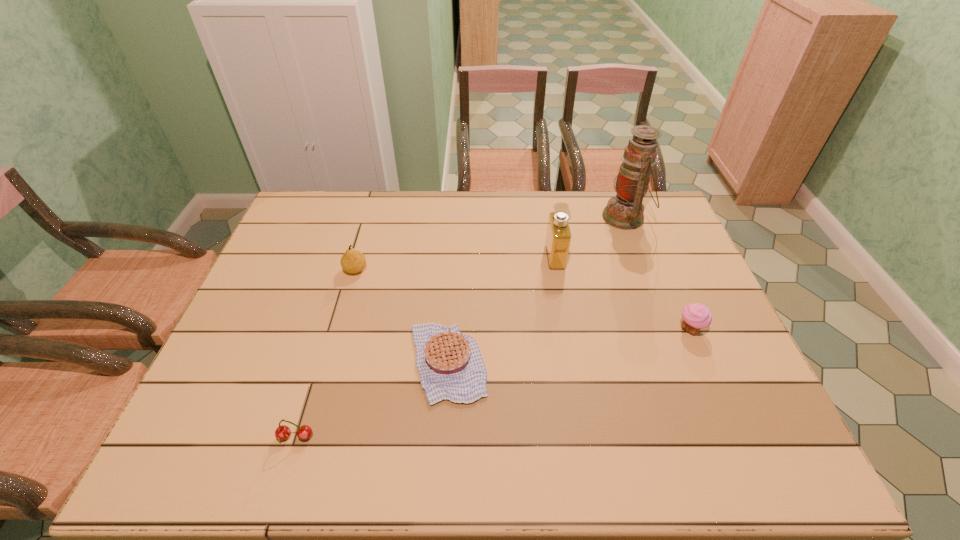
This screenshot has height=540, width=960. Find the location of `free spot located on the front-facing side of the perfume`. free spot located on the front-facing side of the perfume is located at coordinates (513, 257).

Identify the location of vacant space located on the front-facing side of the perfume. (468, 257).

Identify the location of vacant space situated on the front-facing side of the perfume. Image resolution: width=960 pixels, height=540 pixels. (472, 257).

In order to click on free region located on the front of the pear in this screenshot , I will do `click(337, 333)`.

The height and width of the screenshot is (540, 960). What are the coordinates of `vacant space located on the back of the cupcake` in the screenshot? It's located at (670, 283).

Locate an element on the screen. vacant space located 0.240m on the right of the pie is located at coordinates (581, 363).

This screenshot has height=540, width=960. I want to click on object positioned at the far edge, so click(624, 211).

This screenshot has height=540, width=960. What are the coordinates of `object that is at the near edge` in the screenshot? It's located at (304, 432).

Find the location of a particular element. oil lamp that is at the right edge is located at coordinates (624, 211).

In order to click on cupcake positioned at the right edge in this screenshot , I will do `click(696, 316)`.